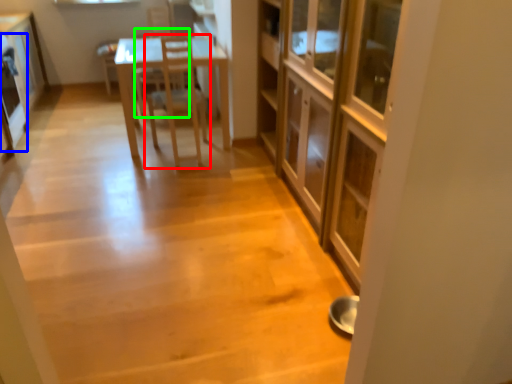
Question: Considering the real-world distances, which object is farthest from chair (highlighted by a red box)? appliance (highlighted by a blue box) or armchair (highlighted by a green box)?

Choices:
 (A) appliance
 (B) armchair

Answer: (A)